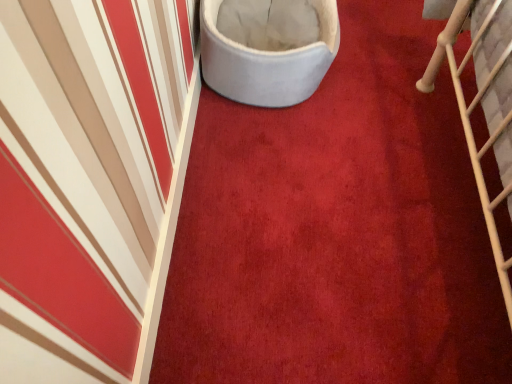
What are the coordinates of `light gray fabric pet bed at center` in the screenshot? It's located at (266, 62).

The image size is (512, 384). Describe the element at coordinates (266, 62) in the screenshot. I see `light gray fabric pet bed at center` at that location.

What are the coordinates of `light gray fabric pet bed at center` in the screenshot? It's located at [266, 62].